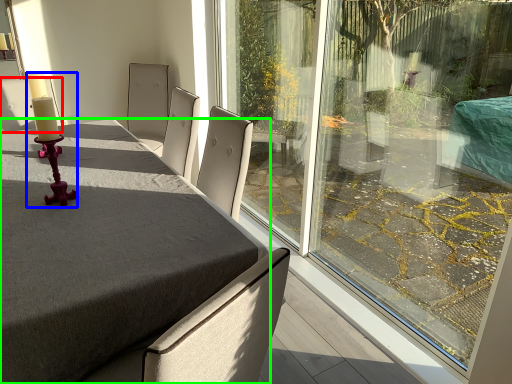
Question: Considering the real-world distances, which object is farthest from chair (highlighted by a red box)? candle holder (highlighted by a blue box) or table (highlighted by a green box)?

Choices:
 (A) candle holder
 (B) table

Answer: (B)